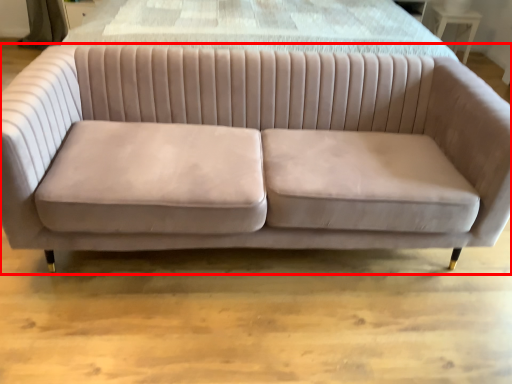
Question: From the image's perspective, what is the correct spatial positioning of studio couch (annotated by the red box) in reference to table?

Choices:
 (A) below
 (B) above

Answer: (A)